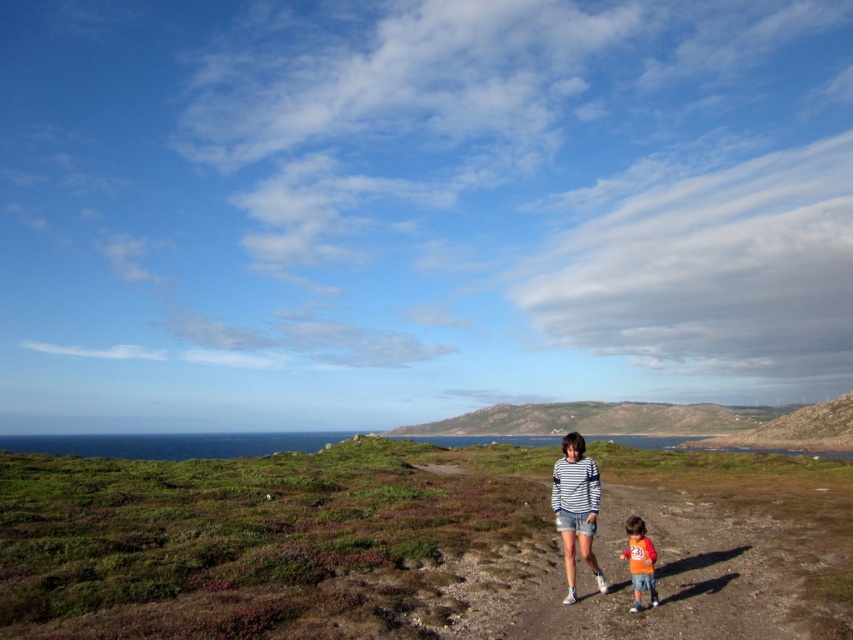
You are standing at the starting point of the dirt path and see the striped shirt at center and the orange cotton shirt at lower center walking ahead. If you want to catch up with them, which one should you chase first?

You should chase the orange cotton shirt at lower center first because the distance between the striped shirt at center and orange cotton shirt at lower center is 5.70 feet, meaning the orange cotton shirt at lower center is closer to you.

You are standing at the starting point of the dirt path and see two points marked on the path ahead. The first point is labeled as point 1 at coordinates point (755, 492) and the second point is labeled as point 2 at coordinates point (566, 532). As you walk along the path, which point will you encounter first?

Point 2 at coordinates point (566, 532) will be encountered first because point 1 at coordinates point (755, 492) is behind it.